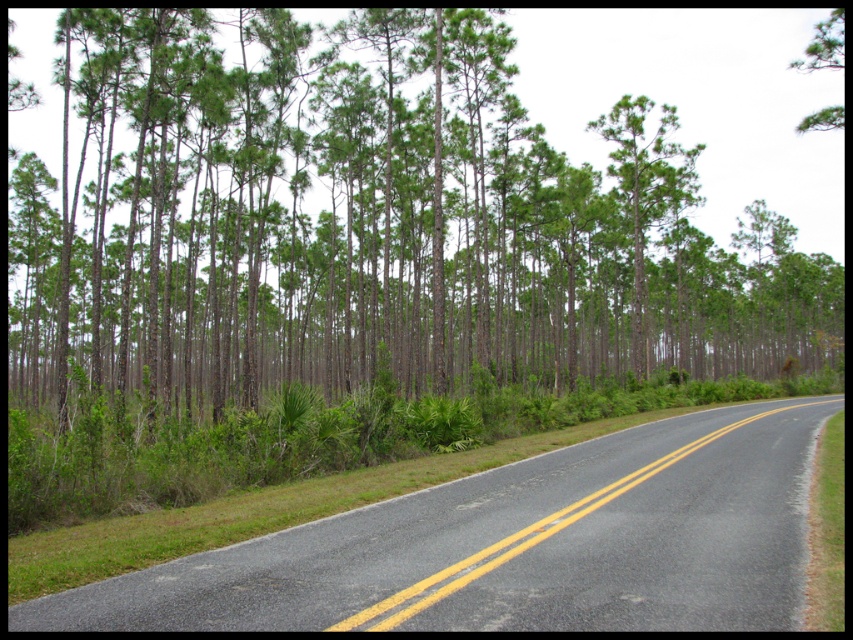
You are standing at the point marked as point (372,225) on the road. Looking ahead, you notice a group of green leafy trees at center. Based on your position, can you determine if the trees are to your left, right, or directly ahead?

The green leafy trees at center are located at point (372,225), which is your current position. Therefore, the trees are directly ahead of you.

You are driving a car and see the green leafy trees at center and the black asphalt road at center ahead. Which object is positioned to the left from your perspective?

The green leafy trees at center are positioned to the left of the black asphalt road at center, so the green leafy trees at center are on the left side.

You are a hiker planning to cross the black asphalt road at center. You need to know if the green leafy trees at center are tall enough to provide shade over the road. Can you determine this based on the scene?

The green leafy trees at center has a greater height compared to black asphalt road at center, so yes, the green leafy trees at center are tall enough to provide shade over the road.